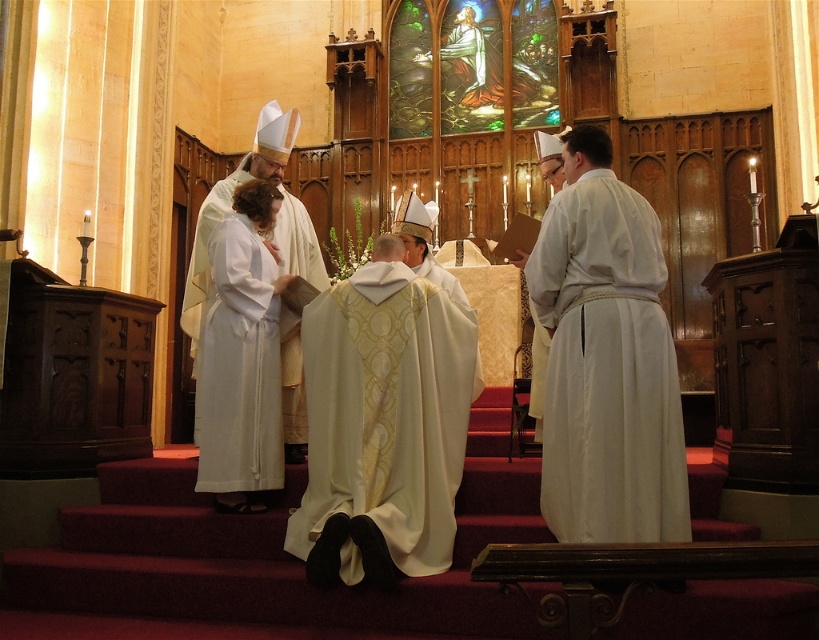
Question: Can you confirm if white satin robe at center is positioned to the right of white silk robe at center?

Choices:
 (A) no
 (B) yes

Answer: (B)

Question: Estimate the real-world distances between objects in this image. Which object is farther from the gold embroidered robe at center?

Choices:
 (A) white satin robe at center
 (B) white silk robe at center
 (C) white matte robe at right

Answer: (B)

Question: Where is white matte robe at right located in relation to white satin robe at center in the image?

Choices:
 (A) right
 (B) left

Answer: (A)

Question: Does white matte robe at right appear over white satin robe at center?

Choices:
 (A) no
 (B) yes

Answer: (B)

Question: Which object is farther from the camera taking this photo?

Choices:
 (A) white silk robe at center
 (B) white matte robe at right

Answer: (A)

Question: Which of these objects is positioned farthest from the gold embroidered robe at center?

Choices:
 (A) white matte robe at right
 (B) white satin robe at center

Answer: (A)